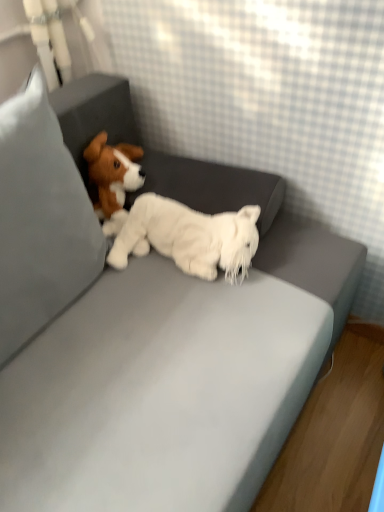
Question: Should I look upward or downward to see white fabric pillow at left?

Choices:
 (A) down
 (B) up

Answer: (B)

Question: Considering the relative sizes of white fabric pillow at left and white plush toy at center in the image provided, is white fabric pillow at left smaller than white plush toy at center?

Choices:
 (A) no
 (B) yes

Answer: (A)

Question: Is white fabric pillow at left positioned beyond the bounds of white plush toy at center?

Choices:
 (A) yes
 (B) no

Answer: (A)

Question: From the image's perspective, is white fabric pillow at left located beneath white plush toy at center?

Choices:
 (A) no
 (B) yes

Answer: (A)

Question: Can you confirm if white fabric pillow at left is bigger than white plush toy at center?

Choices:
 (A) yes
 (B) no

Answer: (A)

Question: Is white plush toy at center at the back of white fabric pillow at left?

Choices:
 (A) yes
 (B) no

Answer: (B)

Question: Is white fabric pillow at left shorter than white plush toy at center?

Choices:
 (A) no
 (B) yes

Answer: (A)

Question: Can you confirm if white plush toy at center is positioned to the left of white fabric pillow at left?

Choices:
 (A) no
 (B) yes

Answer: (A)

Question: Does white plush toy at center have a lesser width compared to white fabric pillow at left?

Choices:
 (A) no
 (B) yes

Answer: (B)

Question: Does white plush toy at center have a greater height compared to white fabric pillow at left?

Choices:
 (A) yes
 (B) no

Answer: (B)

Question: Would you say white plush toy at center is a long distance from white fabric pillow at left?

Choices:
 (A) yes
 (B) no

Answer: (B)

Question: From a real-world perspective, does white plush toy at center stand above white fabric pillow at left?

Choices:
 (A) no
 (B) yes

Answer: (A)

Question: Is the depth of white plush toy at center less than that of white fabric pillow at left?

Choices:
 (A) yes
 (B) no

Answer: (B)

Question: From a real-world perspective, is white fabric pillow at left above or below white plush toy at center?

Choices:
 (A) above
 (B) below

Answer: (A)